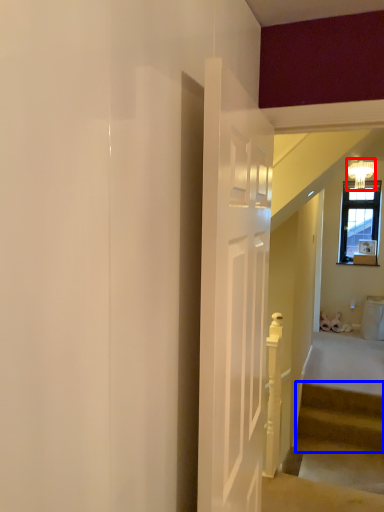
Question: Which object is further to the camera taking this photo, light fixture (highlighted by a red box) or stairs (highlighted by a blue box)?

Choices:
 (A) light fixture
 (B) stairs

Answer: (A)